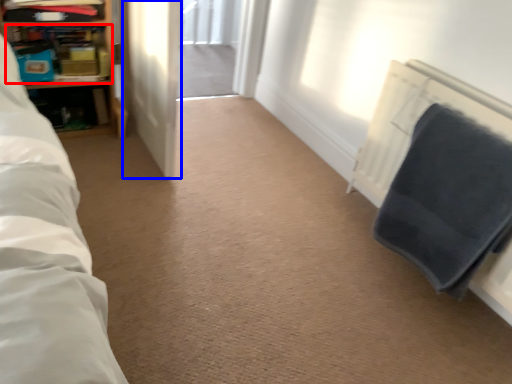
Question: Among these objects, which one is nearest to the camera, shelf (highlighted by a red box) or screen door (highlighted by a blue box)?

Choices:
 (A) shelf
 (B) screen door

Answer: (B)